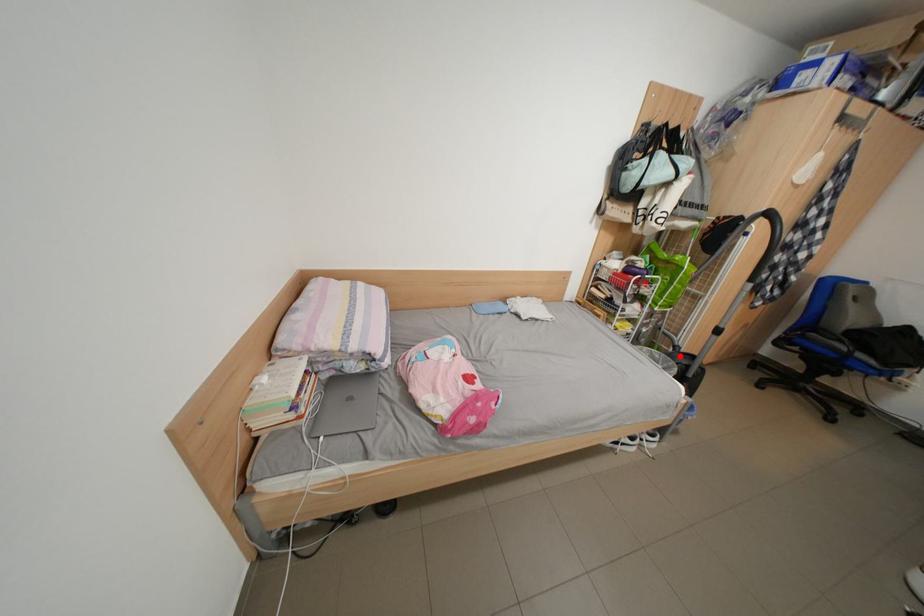
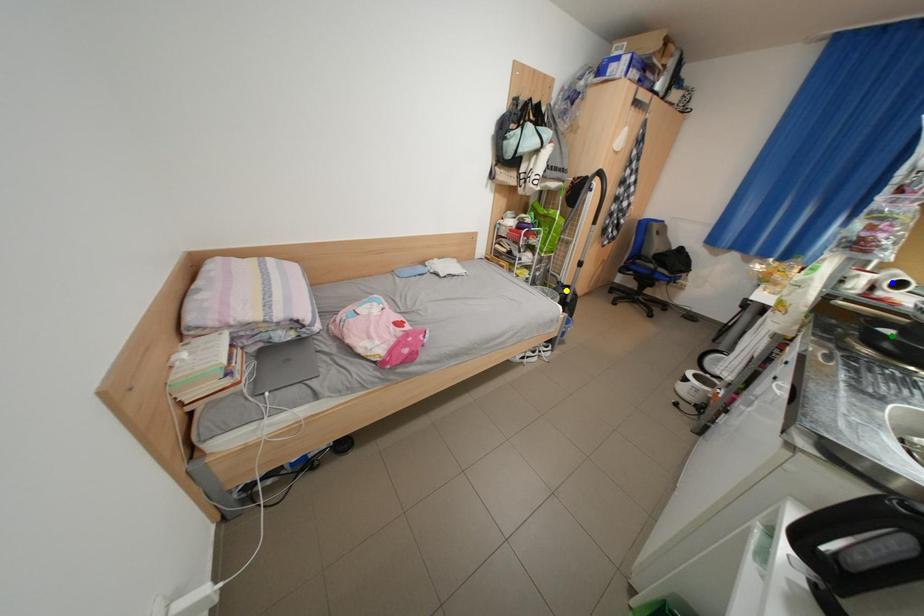
Question: I am providing you with two images of the same scene from different viewpoints. A red point is marked on the first image. You are given multiple points on the second image. Which mark in image 2 goes with the point in image 1?

Choices:
 (A) blue point
 (B) green point
 (C) yellow point

Answer: (C)